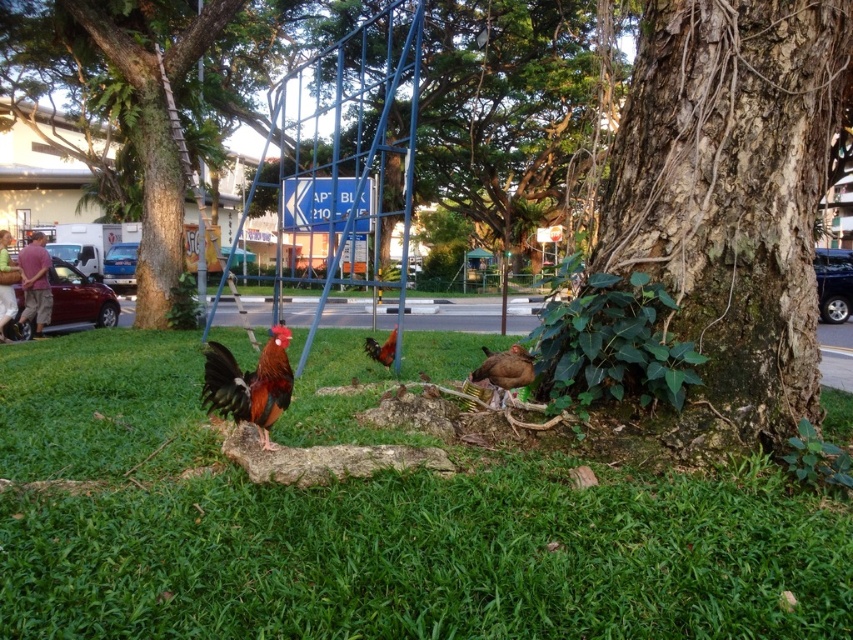
Question: Which is farther from the green grass at lower center?

Choices:
 (A) smooth bark tree at lower right
 (B) brown glossy chicken at center

Answer: (B)

Question: Is shiny brown chicken at center positioned at the back of brown glossy chicken at center?

Choices:
 (A) no
 (B) yes

Answer: (A)

Question: Is brown matte chicken at lower center to the left of brown glossy chicken at center from the viewer's perspective?

Choices:
 (A) yes
 (B) no

Answer: (B)

Question: Does smooth bark tree at lower right appear on the left side of smooth brown tree trunk at left?

Choices:
 (A) no
 (B) yes

Answer: (A)

Question: Which point is farther to the camera?

Choices:
 (A) (173, 246)
 (B) (729, 365)

Answer: (A)

Question: Which point is farther from the camera taking this photo?

Choices:
 (A) (189, 170)
 (B) (202, 464)
 (C) (256, 365)

Answer: (A)